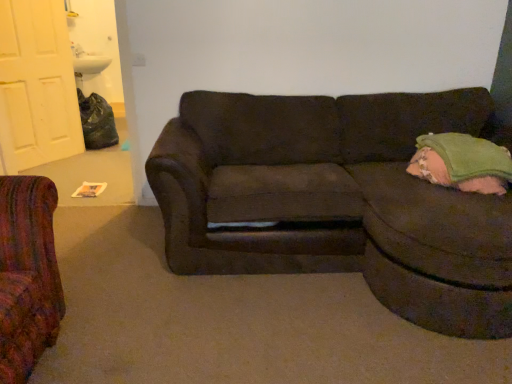
What do you see at coordinates (36, 85) in the screenshot? I see `white matte door at upper left` at bounding box center [36, 85].

Identify the location of dark brown fabric couch at center. The width and height of the screenshot is (512, 384). (338, 199).

Consider the image. Considering their positions, is dark brown fabric couch at center located in front of or behind white matte door at upper left?

Clearly, dark brown fabric couch at center is in front of white matte door at upper left.

Considering the relative sizes of dark brown fabric couch at center and white matte door at upper left in the image provided, is dark brown fabric couch at center bigger than white matte door at upper left?

Yes, dark brown fabric couch at center is bigger than white matte door at upper left.

From the image's perspective, which object appears higher, dark brown fabric couch at center or white matte door at upper left?

white matte door at upper left appears higher in the image.

In terms of height, does dark brown fabric couch at center look taller or shorter compared to white matte door at upper left?

Clearly, dark brown fabric couch at center is shorter compared to white matte door at upper left.

Consider the image. Considering the relative sizes of green fabric pillow at right and dark brown fabric couch at center in the image provided, is green fabric pillow at right taller than dark brown fabric couch at center?

Incorrect, the height of green fabric pillow at right is not larger of that of dark brown fabric couch at center.

Is green fabric pillow at right oriented away from dark brown fabric couch at center?

Yes, green fabric pillow at right's orientation is away from dark brown fabric couch at center.

Considering their positions, is green fabric pillow at right located in front of or behind dark brown fabric couch at center?

Clearly, green fabric pillow at right is behind dark brown fabric couch at center.

I want to click on door on the left of the green fabric pillow at right, so click(36, 85).

Is white matte door at upper left further to camera compared to green fabric pillow at right?

That is True.

Between white matte door at upper left and green fabric pillow at right, which one has less height?

Standing shorter between the two is green fabric pillow at right.

How many degrees apart are the facing directions of white matte door at upper left and green fabric pillow at right?

The angle between the facing direction of white matte door at upper left and the facing direction of green fabric pillow at right is 51.9 degrees.

Image resolution: width=512 pixels, height=384 pixels. I want to click on studio couch below the green fabric pillow at right (from the image's perspective), so click(338, 199).

Can we say dark brown fabric couch at center lies outside green fabric pillow at right?

Indeed, dark brown fabric couch at center is completely outside green fabric pillow at right.

From their relative heights in the image, would you say dark brown fabric couch at center is taller or shorter than green fabric pillow at right?

Considering their sizes, dark brown fabric couch at center has more height than green fabric pillow at right.

From the image's perspective, which one is positioned higher, dark brown fabric couch at center or green fabric pillow at right?

green fabric pillow at right.

Is green fabric pillow at right facing away from white matte door at upper left?

No, green fabric pillow at right is not facing away from white matte door at upper left.

Considering their positions, is green fabric pillow at right located in front of or behind white matte door at upper left?

Clearly, green fabric pillow at right is in front of white matte door at upper left.

Is green fabric pillow at right directly adjacent to white matte door at upper left?

green fabric pillow at right and white matte door at upper left are not in contact.

Is point (478, 185) less distant than point (42, 51)?

Yes, it is.

From a real-world perspective, between white matte door at upper left and dark brown fabric couch at center, who is vertically lower?

dark brown fabric couch at center, from a real-world perspective.

Can you confirm if white matte door at upper left is wider than dark brown fabric couch at center?

In fact, white matte door at upper left might be narrower than dark brown fabric couch at center.

From the picture: Can you tell me how much white matte door at upper left and dark brown fabric couch at center differ in facing direction?

54.2 degrees separate the facing orientations of white matte door at upper left and dark brown fabric couch at center.

Can you confirm if white matte door at upper left is positioned to the left of dark brown fabric couch at center?

Yes.

In order to click on door above the dark brown fabric couch at center (from the image's perspective) in this screenshot , I will do (36, 85).

At what (x,y) coordinates should I click in order to perform the action: click on pillow behind the dark brown fabric couch at center. Please return your answer as a coordinate pair (x, y). The height and width of the screenshot is (384, 512). Looking at the image, I should click on (462, 163).

From the image, which object appears to be farther from green fabric pillow at right, white matte door at upper left or dark brown fabric couch at center?

white matte door at upper left is further to green fabric pillow at right.

Which object lies nearer to the anchor point white matte door at upper left, green fabric pillow at right or dark brown fabric couch at center?

The object closer to white matte door at upper left is dark brown fabric couch at center.

When comparing their distances from white matte door at upper left, does dark brown fabric couch at center or green fabric pillow at right seem closer?

Among the two, dark brown fabric couch at center is located nearer to white matte door at upper left.

From the image, which object appears to be farther from dark brown fabric couch at center, white matte door at upper left or green fabric pillow at right?

white matte door at upper left lies further to dark brown fabric couch at center than the other object.

From the image, which object appears to be farther from green fabric pillow at right, dark brown fabric couch at center or white matte door at upper left?

Among the two, white matte door at upper left is located further to green fabric pillow at right.

Based on their spatial positions, is green fabric pillow at right or white matte door at upper left closer to dark brown fabric couch at center?

green fabric pillow at right is positioned closer to the anchor dark brown fabric couch at center.

This screenshot has height=384, width=512. Identify the location of studio couch between white matte door at upper left and green fabric pillow at right from left to right. (338, 199).